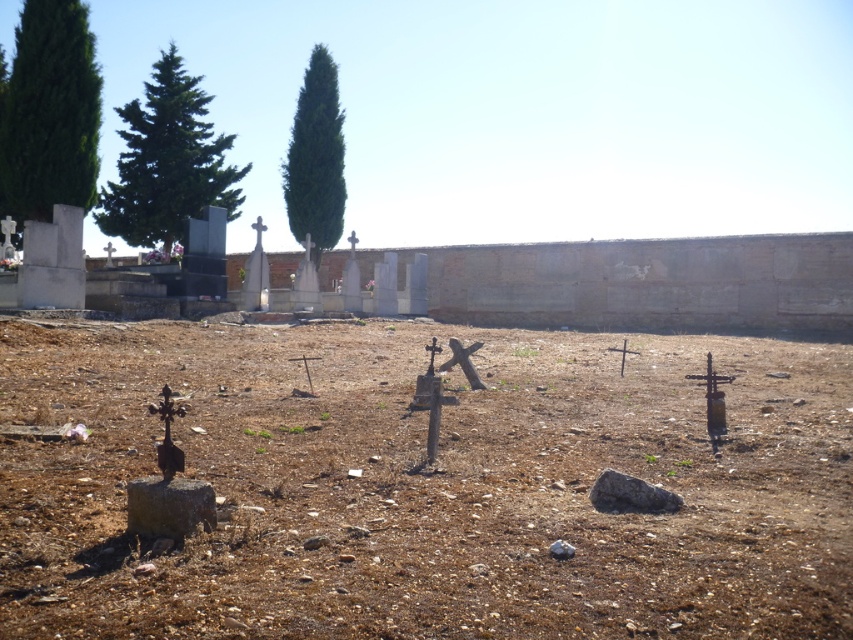
Who is more forward, (612, 552) or (59, 28)?

Positioned in front is point (612, 552).

Is brown dirt field at center positioned behind green leafy tree at upper left?

No, it is in front of green leafy tree at upper left.

Is point (511, 512) less distant than point (18, 76)?

Yes, point (511, 512) is closer to viewer.

Identify the location of brown dirt field at center. This screenshot has width=853, height=640. (426, 486).

Does brown dirt field at center appear on the right side of green textured tree at upper left?

Correct, you'll find brown dirt field at center to the right of green textured tree at upper left.

Who is more distant from viewer, [395,624] or [158,212]?

Point [158,212]

Which is in front, point (525, 524) or point (166, 102)?

Point (525, 524) is more forward.

This screenshot has height=640, width=853. Find the location of `brown dirt field at center`. brown dirt field at center is located at coordinates (426, 486).

Does brown dirt field at center appear over green textured tree at center?

No.

Can you confirm if brown dirt field at center is shorter than green textured tree at center?

Correct, brown dirt field at center is not as tall as green textured tree at center.

Measure the distance between brown dirt field at center and camera.

They are 11.20 feet apart.

I want to click on brown dirt field at center, so click(x=426, y=486).